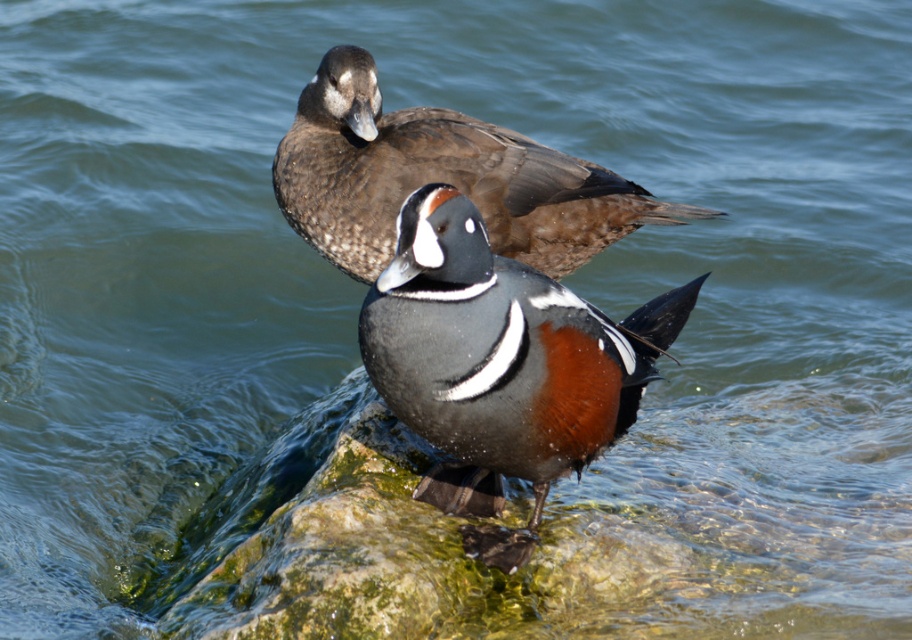
Who is positioned more to the left, matte black duck at center or brown speckled duck at upper center?

From the viewer's perspective, brown speckled duck at upper center appears more on the left side.

In order to click on matte black duck at center in this screenshot , I will do `click(500, 364)`.

Where is `matte black duck at center`? This screenshot has width=912, height=640. matte black duck at center is located at coordinates (500, 364).